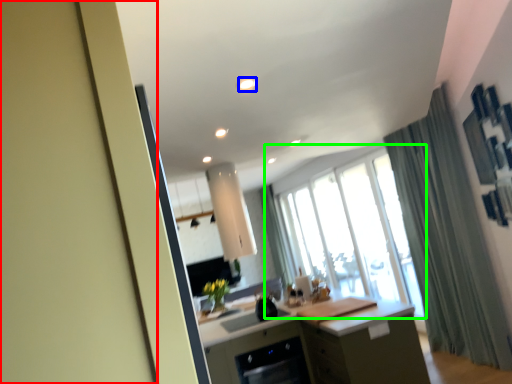
Question: Which object is the farthest from screen door (highlighted by a red box)? Choose among these: light (highlighted by a blue box) or window (highlighted by a green box).

Choices:
 (A) light
 (B) window

Answer: (B)